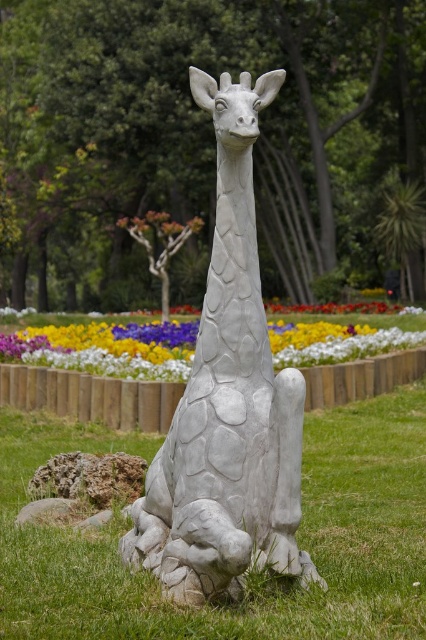
You are standing in the park and see the statue of a giraffe. There is a point marked at coordinates (255, 580). According to the image, what is located at that point?

The point at coordinates (255, 580) marks green grass at lower center.

You are standing in the park and looking at the giraffe statue. There are two points on the statue labeled as point 1 and point 2. If point 1 is at coordinate point (307, 576) and point 2 is at coordinate point (422, 324), which point is closer to your eyes?

Point 1 at coordinate point (307, 576) is closer to your eyes because it is closer to the camera than point 2 at coordinate point (422, 324).